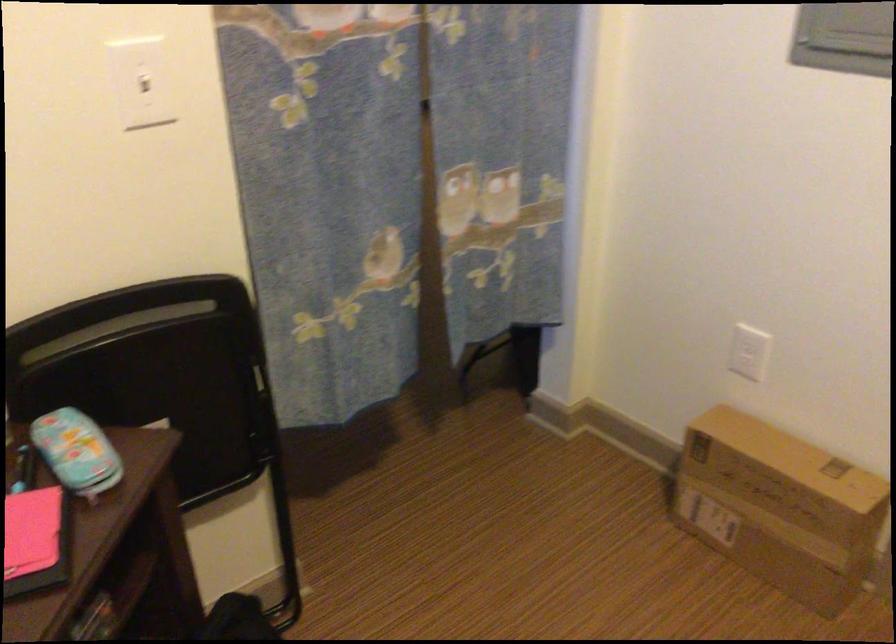
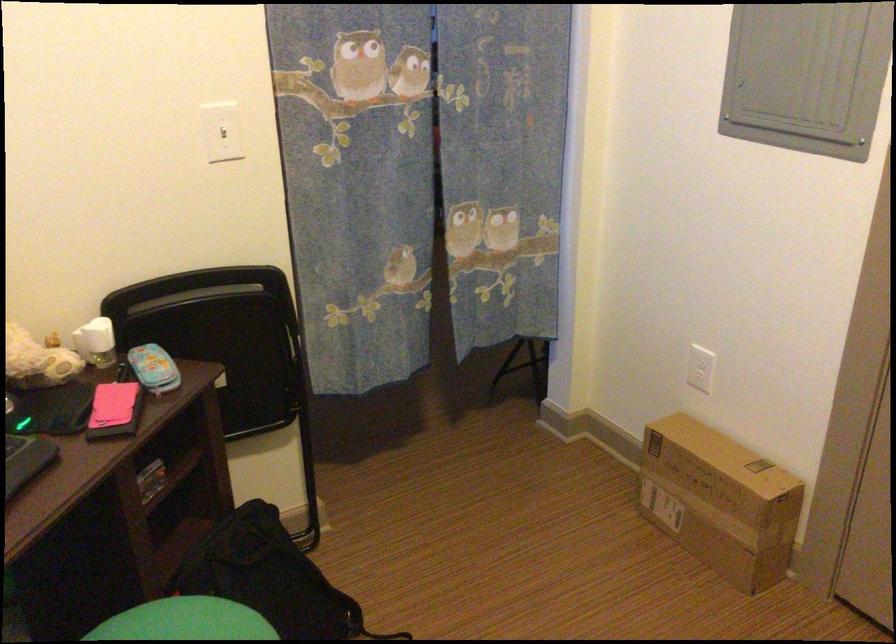
Find the pixel in the second image that matches pixel 789 516 in the first image.

(719, 500)